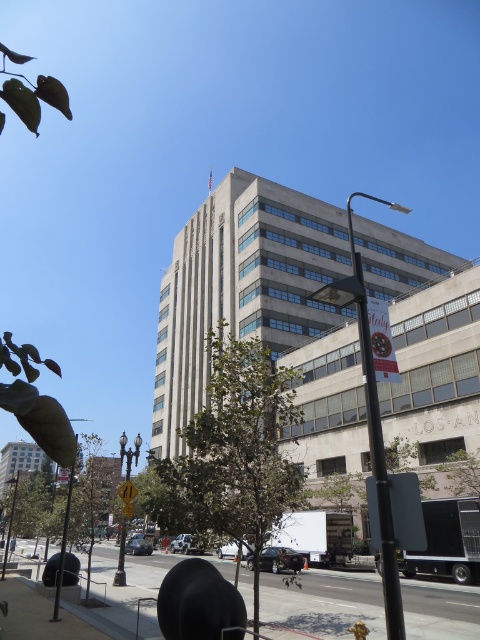
You are standing at the point marked by the coordinates (232, 452) in the image. What object are you directly facing?

The point at coordinates (232, 452) indicates a green leafy tree at center, so you are directly facing the green leafy tree at center.

In the scene shown: You are a city planner assessing the space between the green leafy tree at lower left and the yellow reflective street sign at center. Based on their widths, do you think there is enough room for a 1.2 meter wide pedestrian bench?

The green leafy tree at lower left might be wider than the yellow reflective street sign at center, so the space between them may not be sufficient for placing a 1.2 meter wide pedestrian bench. It is advisable to measure the exact distance before installation.

You are a pedestrian standing on the sidewalk and see the green leafy tree at lower left and the yellow reflective street sign at center. Which object is closer to your left side?

The green leafy tree at lower left is closer to your left side since it is positioned on the left side of the yellow reflective street sign at center.